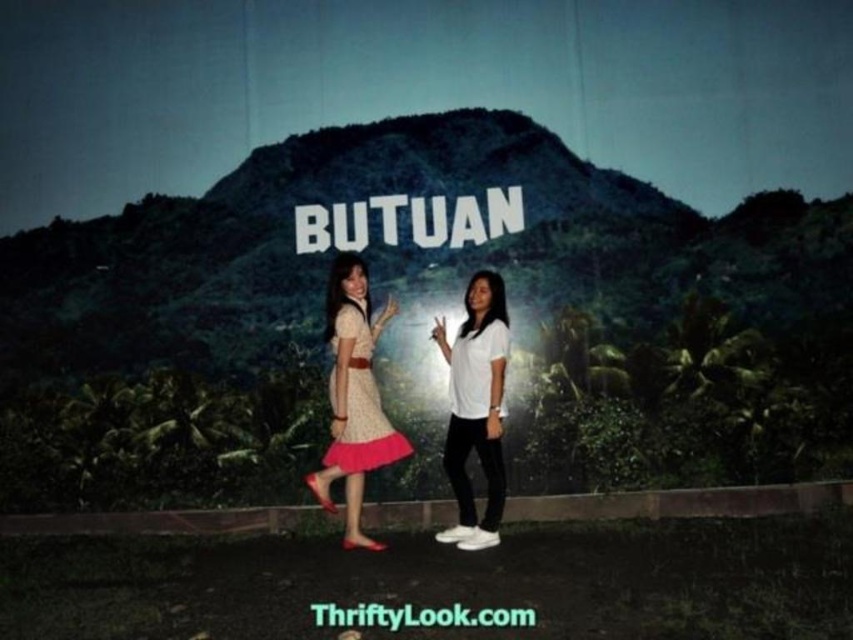
Question: Which object is positioned closest to the matte white sign at center?

Choices:
 (A) polka dot fabric dress at center
 (B) white matte shirt at center

Answer: (A)

Question: Does matte white sign at center appear on the left side of white matte shirt at center?

Choices:
 (A) no
 (B) yes

Answer: (B)

Question: Which point is closer to the camera?

Choices:
 (A) matte white sign at center
 (B) white matte shirt at center
 (C) polka dot fabric dress at center

Answer: (B)

Question: Which of the following is the closest to the observer?

Choices:
 (A) polka dot fabric dress at center
 (B) white matte shirt at center
 (C) matte white sign at center

Answer: (B)

Question: Does matte white sign at center appear under polka dot fabric dress at center?

Choices:
 (A) yes
 (B) no

Answer: (B)

Question: Is polka dot fabric dress at center above white matte shirt at center?

Choices:
 (A) yes
 (B) no

Answer: (A)